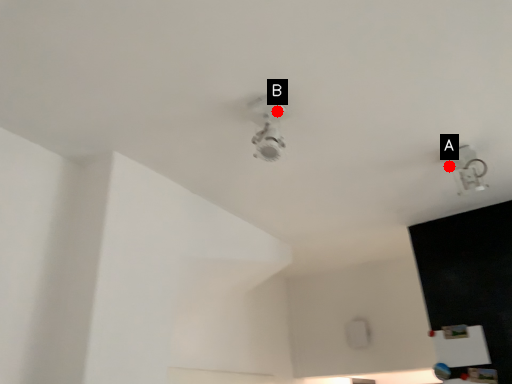
Question: Two points are circled on the image, labeled by A and B beside each circle. Which point is closer to the camera taking this photo?

Choices:
 (A) A is closer
 (B) B is closer

Answer: (B)